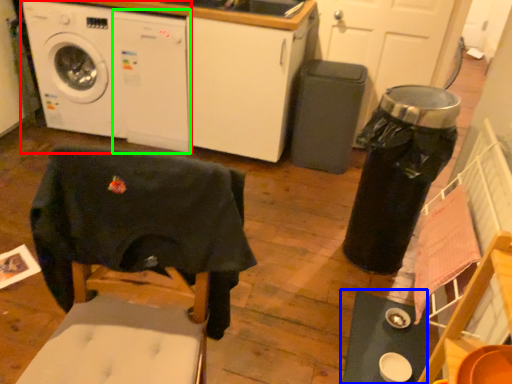
Question: Which object is positioned farthest from washing machine (highlighted by a red box)? Select from table (highlighted by a blue box) and washing machine (highlighted by a green box).

Choices:
 (A) table
 (B) washing machine

Answer: (A)